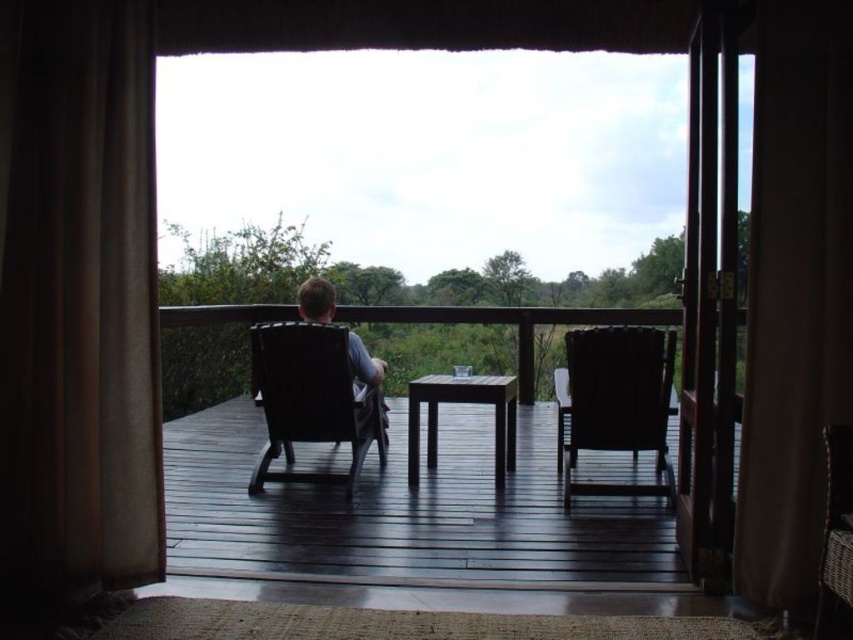
This screenshot has width=853, height=640. In order to click on transparent plastic screen door at right in this screenshot , I will do click(709, 298).

Is transparent plastic screen door at right to the right of matte black chair at center from the viewer's perspective?

Indeed, transparent plastic screen door at right is positioned on the right side of matte black chair at center.

Is point (728, 531) farther from camera compared to point (370, 413)?

No, (728, 531) is in front of (370, 413).

Identify the location of transparent plastic screen door at right. (709, 298).

Who is more distant from viewer, (705, 362) or (332, 353)?

Point (332, 353)

Consider the image. Which is more to the left, transparent glass door at center or matte black chair at center?

matte black chair at center is more to the left.

Find the location of `transparent glass door at center`. transparent glass door at center is located at coordinates (686, 196).

Which is below, dark wood deck at center or dark brown wooden table at center?

Positioned lower is dark wood deck at center.

Can you confirm if dark wood deck at center is shorter than dark brown wooden table at center?

Yes, dark wood deck at center is shorter than dark brown wooden table at center.

Is point (360, 492) positioned in front of point (425, 385)?

Yes, it is in front of point (425, 385).

Identify the location of dark wood deck at center. (405, 509).